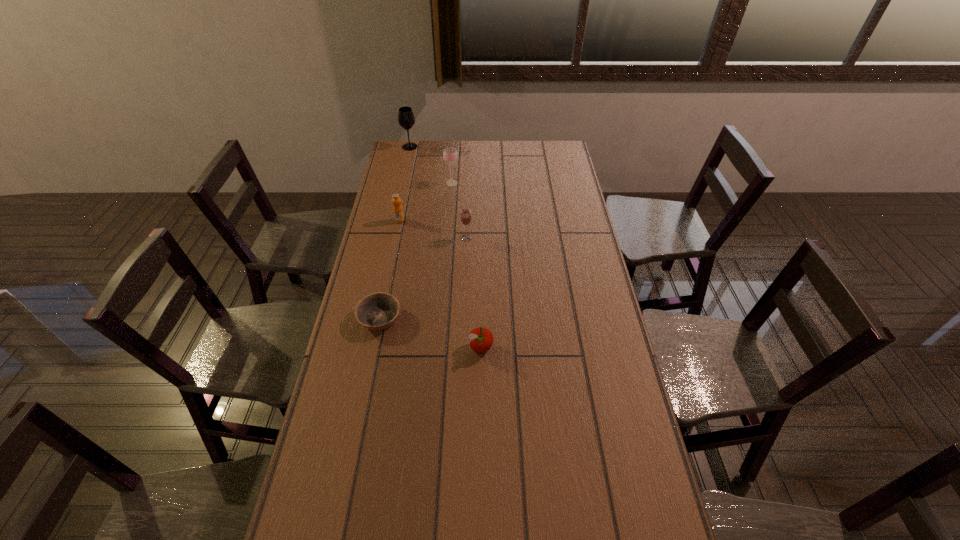
Where is `the leftmost wineglass`? The width and height of the screenshot is (960, 540). the leftmost wineglass is located at coordinates (406, 119).

In order to click on the tallest object in this screenshot , I will do `click(406, 119)`.

Identify the location of the second tallest object. (450, 155).

The width and height of the screenshot is (960, 540). I want to click on the second tallest wineglass, so click(x=450, y=155).

You are a GUI agent. You are given a task and a screenshot of the screen. Output one action in this format:
    pyautogui.click(x=<x>, y=<y>)
    Task: Click on the third nearest object
    The image size is (960, 540).
    Given the screenshot: What is the action you would take?
    click(465, 217)

The image size is (960, 540). I want to click on the shortest wineglass, so click(x=465, y=217).

You are a GUI agent. You are given a task and a screenshot of the screen. Output one action in this format:
    pyautogui.click(x=<x>, y=<y>)
    Task: Click on the fourth nearest object
    This screenshot has height=540, width=960.
    Given the screenshot: What is the action you would take?
    pyautogui.click(x=398, y=213)

Where is `the second shortest object`? The width and height of the screenshot is (960, 540). the second shortest object is located at coordinates (481, 338).

Identify the location of apple. Image resolution: width=960 pixels, height=540 pixels. (481, 338).

Where is `the fifth farthest object`? the fifth farthest object is located at coordinates (378, 311).